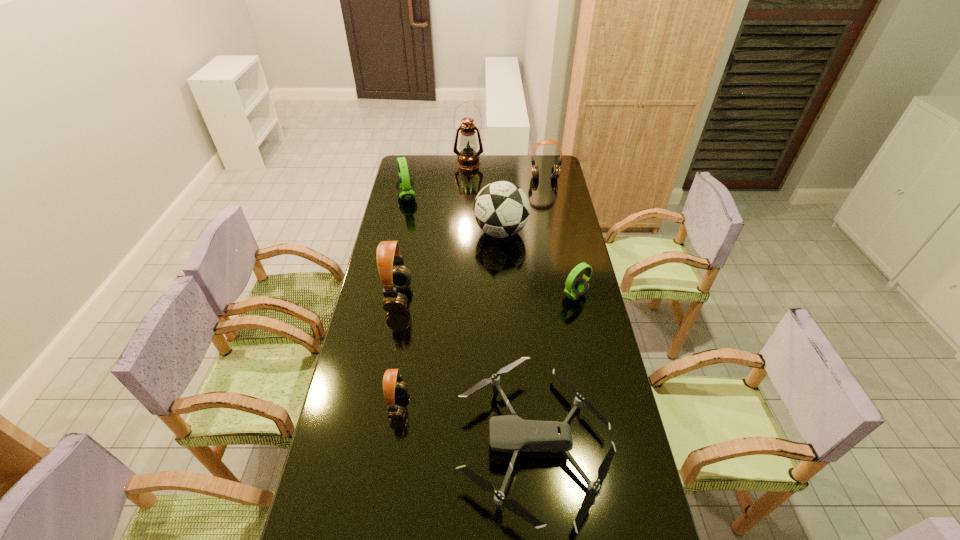
Where is `the farthest object`? the farthest object is located at coordinates (468, 158).

Locate an element on the screen. The width and height of the screenshot is (960, 540). the tallest object is located at coordinates (468, 158).

Locate an element on the screen. This screenshot has height=540, width=960. the second farthest brown headset is located at coordinates (388, 255).

Locate an element on the screen. The height and width of the screenshot is (540, 960). the biggest brown headset is located at coordinates (388, 255).

You are a GUI agent. You are given a task and a screenshot of the screen. Output one action in this format:
    pyautogui.click(x=<x>, y=<y>)
    Task: Click on the soccer ball
    
    Given the screenshot: What is the action you would take?
    click(501, 209)

Identify the location of black soccer ball. The image size is (960, 540). (501, 209).

Identify the location of the farther green headset. (405, 188).

The image size is (960, 540). Find the location of `the bigger green headset`. the bigger green headset is located at coordinates (405, 188).

Where is `the farthest brown headset`? The image size is (960, 540). the farthest brown headset is located at coordinates (555, 170).

The height and width of the screenshot is (540, 960). I want to click on the second smallest brown headset, so click(x=555, y=170).